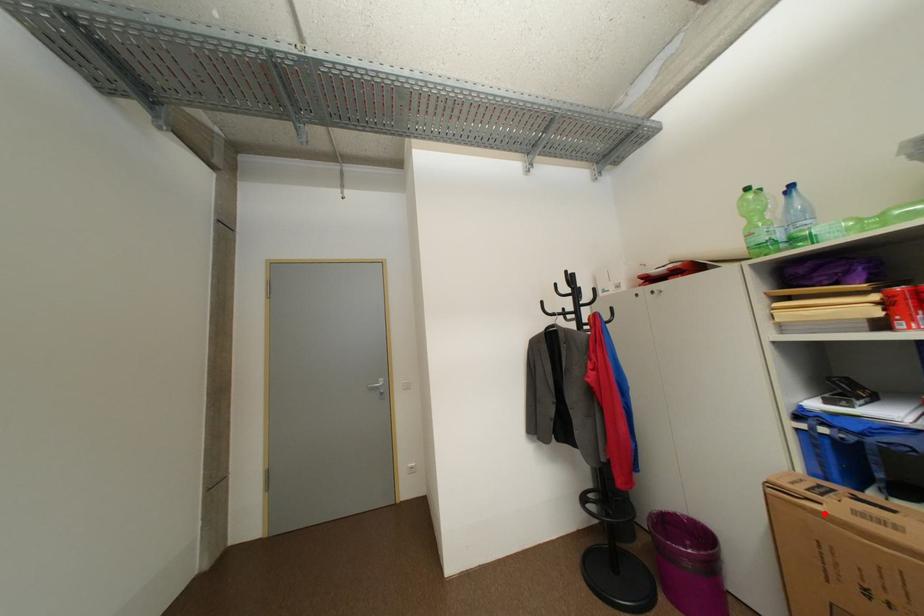
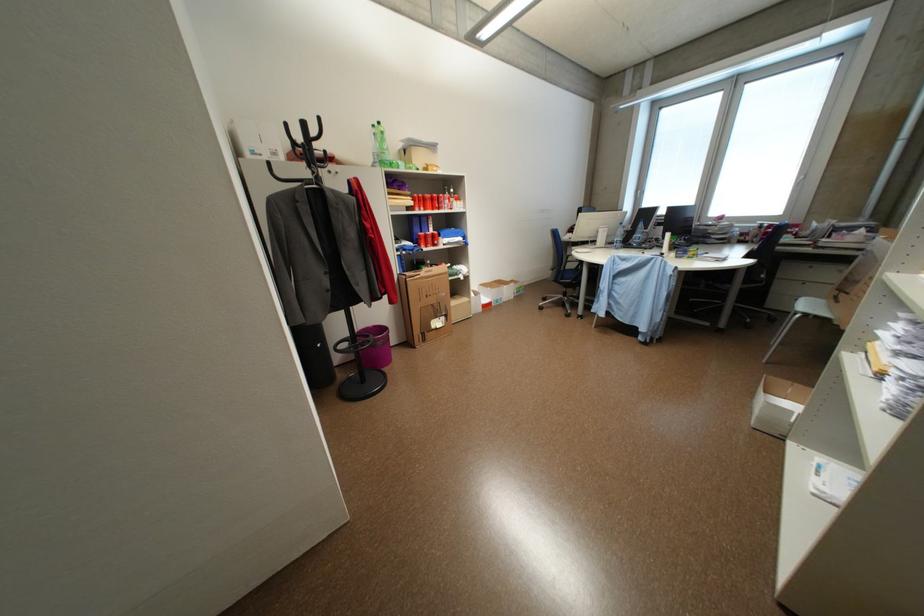
Locate, in the second image, the point that corresponds to the highlighted location in the first image.

(428, 280)